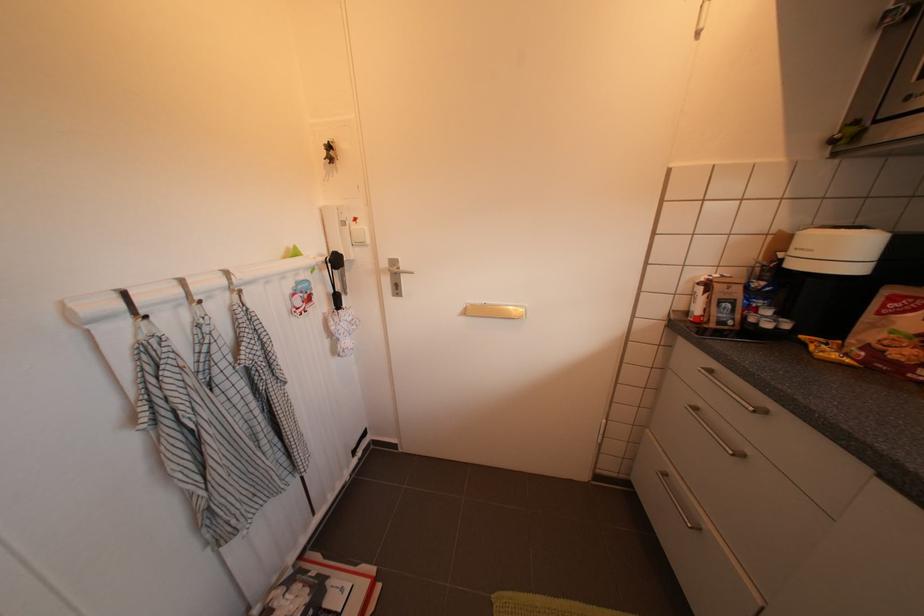
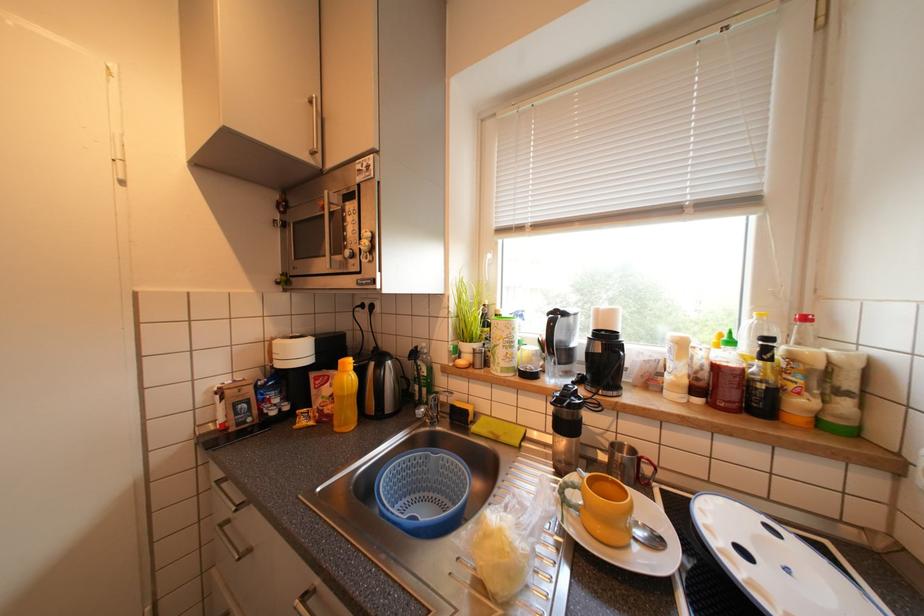
Question: The images are taken continuously from a first-person perspective. In which direction is your viewpoint rotating?

Choices:
 (A) Left
 (B) Right
 (C) Up
 (D) Down

Answer: (B)